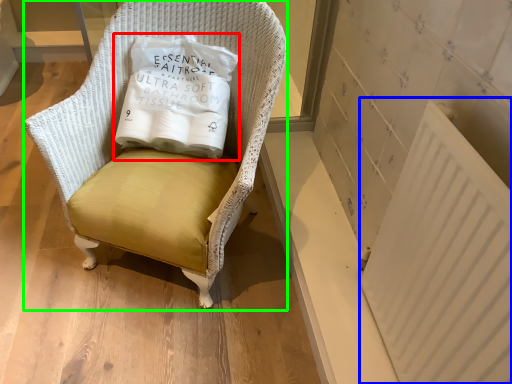
Question: Based on their relative distances, which object is nearer to pillow (highlighted by a red box)? Choose from radiator (highlighted by a blue box) and chair (highlighted by a green box).

Choices:
 (A) radiator
 (B) chair

Answer: (B)